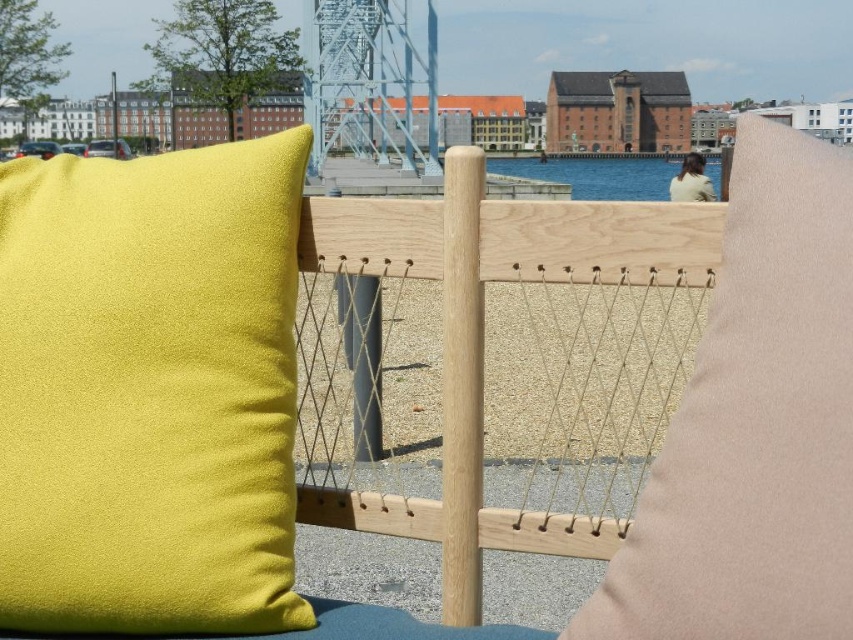
Which is above, lime green fabric pillow at left or natural wood fence at center?

Positioned higher is lime green fabric pillow at left.

Identify the location of lime green fabric pillow at left. (149, 390).

Is point (235, 397) in front of point (453, 464)?

That is True.

Identify the location of lime green fabric pillow at left. The width and height of the screenshot is (853, 640). (149, 390).

Can you confirm if natural wood fence at center is positioned to the right of blue water at center?

No, natural wood fence at center is not to the right of blue water at center.

Who is more distant from viewer, (310, 490) or (572, 182)?

The point (572, 182) is behind.

Find the location of a particular element. natural wood fence at center is located at coordinates (491, 365).

Is lime green fabric pillow at left taller than blue water at center?

Incorrect, lime green fabric pillow at left's height is not larger of blue water at center's.

Between lime green fabric pillow at left and blue water at center, which one has more height?

Standing taller between the two is blue water at center.

Where is `lime green fabric pillow at left`? The image size is (853, 640). lime green fabric pillow at left is located at coordinates (149, 390).